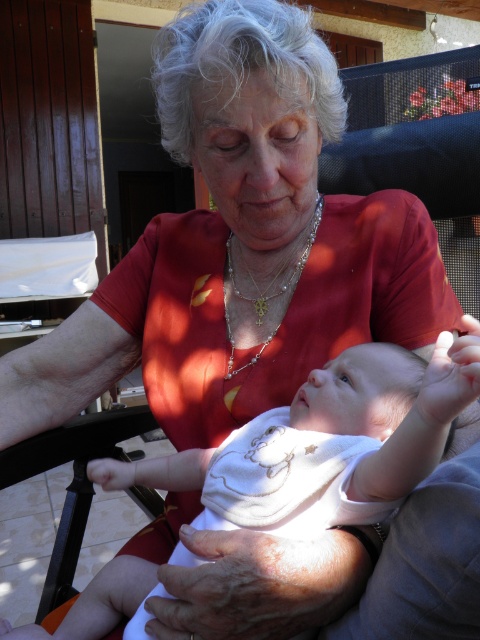
Question: Can you confirm if white soft fabric baby at center is bigger than pearl/pearly necklace at center?

Choices:
 (A) no
 (B) yes

Answer: (B)

Question: Which point appears closest to the camera in this image?

Choices:
 (A) (274, 294)
 (B) (367, 362)

Answer: (B)

Question: Among these objects, which one is nearest to the camera?

Choices:
 (A) pearl/pearly necklace at center
 (B) white soft fabric baby at center

Answer: (B)

Question: Does white soft fabric baby at center appear under pearl/pearly necklace at center?

Choices:
 (A) yes
 (B) no

Answer: (A)

Question: Does white soft fabric baby at center lie behind pearl/pearly necklace at center?

Choices:
 (A) no
 (B) yes

Answer: (A)